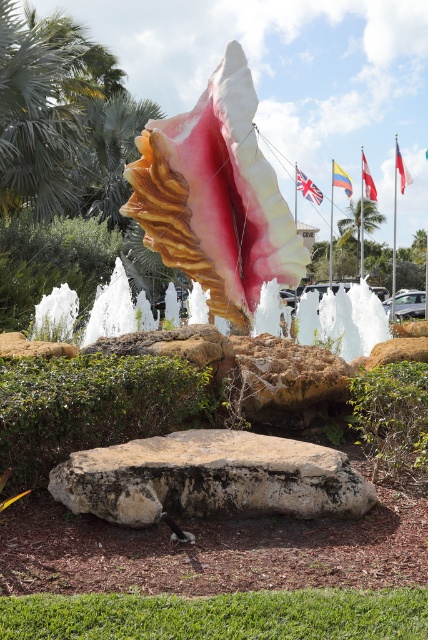
From the picture: You are standing in front of the conch shell sculpture and want to reach a point that is exactly 13.21 meters away from where you are standing. Can you confirm if the point marked at coordinates point (372, 296) is exactly that distance away?

Yes, the point marked at coordinates point (372, 296) is exactly 13.21 meters away from the viewer, so you can reach that point by going to the marked coordinates.

You are standing at the base of the large conch shell sculpture in the image. Looking around, you notice a point marked at coordinates (359, 221). What object does this point correspond to?

The point corresponds to the green leafy palm tree at upper center.